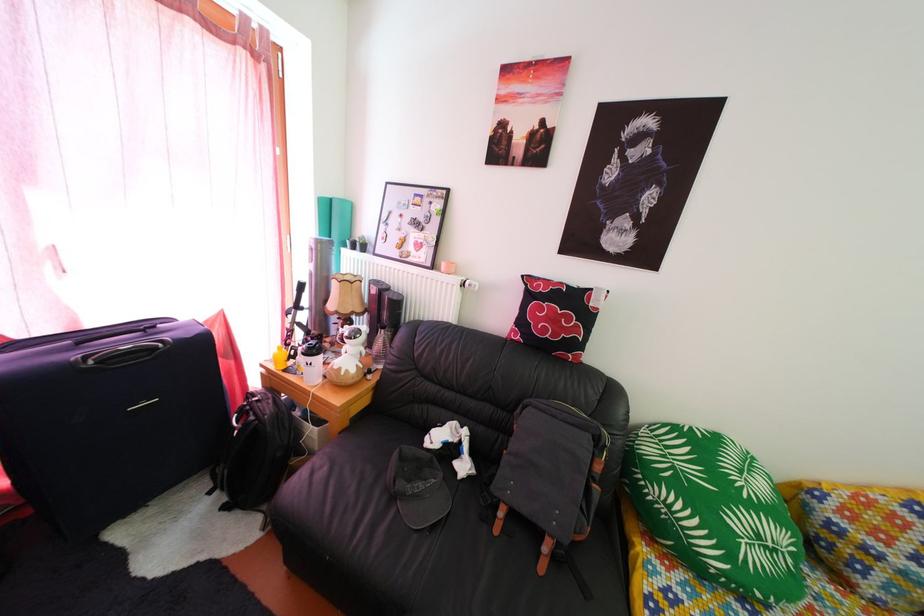
The location [311,362] corresponds to which object?

It refers to a white ceramic mug.